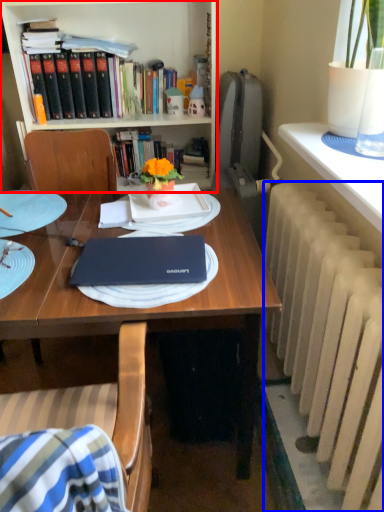
Question: Which of the following is the farthest to the observer, bookcase (highlighted by a red box) or radiator (highlighted by a blue box)?

Choices:
 (A) bookcase
 (B) radiator

Answer: (A)